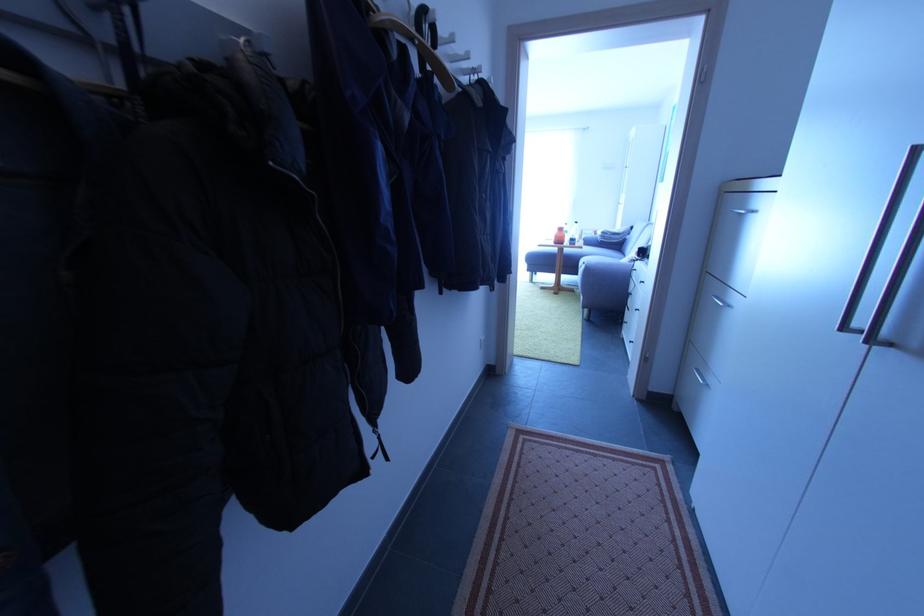
Describe the element at coordinates (603, 283) in the screenshot. Image resolution: width=924 pixels, height=616 pixels. I see `a sofa armrest` at that location.